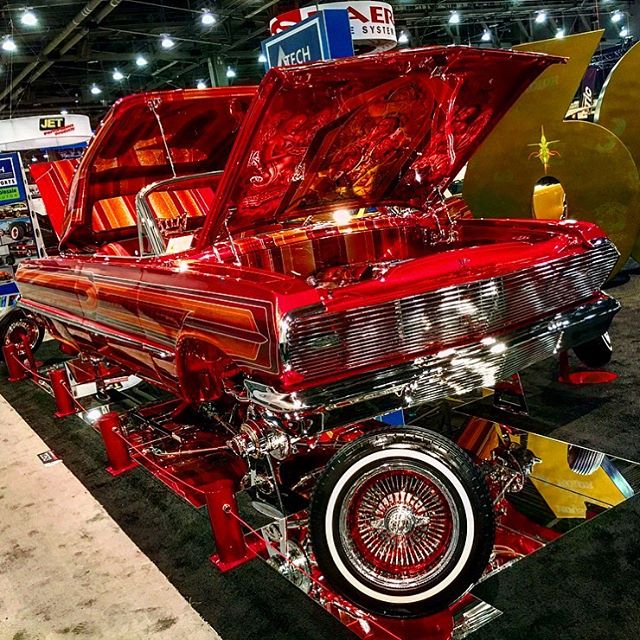
Identify the location of hood. pos(348,144).